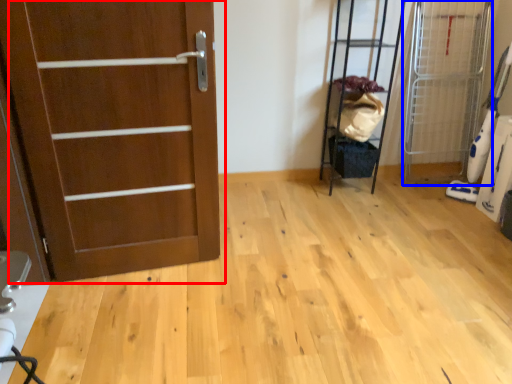
Question: Among these objects, which one is farthest to the camera, door (highlighted by a red box) or elevator (highlighted by a blue box)?

Choices:
 (A) door
 (B) elevator

Answer: (B)